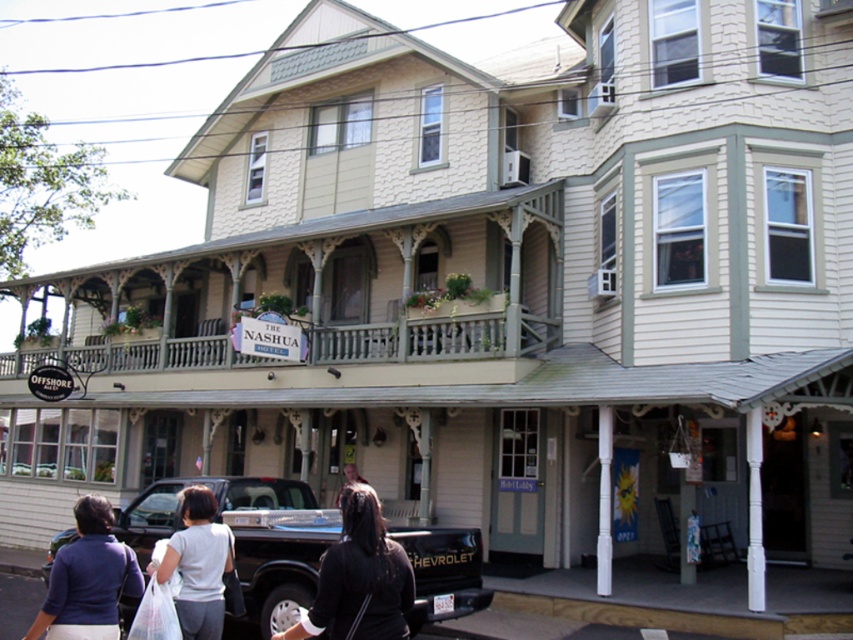
Is black matte truck at lower center bigger than white fabric bag at lower center?

Actually, black matte truck at lower center might be smaller than white fabric bag at lower center.

Locate an element on the screen. black matte truck at lower center is located at coordinates (247, 540).

Is black matte truck at lower center to the right of wooden porch at center from the viewer's perspective?

Correct, you'll find black matte truck at lower center to the right of wooden porch at center.

Is black matte truck at lower center to the left of wooden porch at center from the viewer's perspective?

In fact, black matte truck at lower center is to the right of wooden porch at center.

Measure the distance between point (424, 582) and camera.

Point (424, 582) is 32.62 feet away from camera.

Where is `black matte truck at lower center`? black matte truck at lower center is located at coordinates (247, 540).

Based on the photo, is wooden porch at center bigger than white fabric bag at lower center?

Yes, wooden porch at center is bigger than white fabric bag at lower center.

Is point (366, 342) behind point (184, 588)?

That is True.

Image resolution: width=853 pixels, height=640 pixels. Identify the location of wooden porch at center. (410, 340).